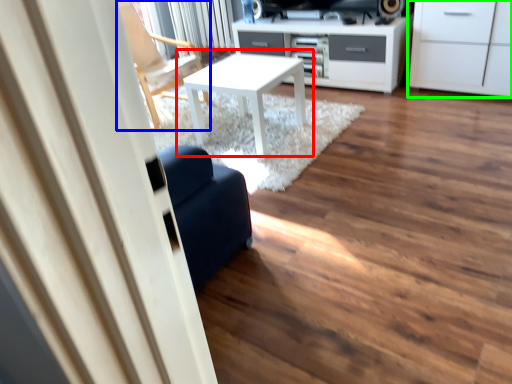
Question: Based on their relative distances, which object is farther from table (highlighted by a red box)? Choose from chair (highlighted by a blue box) and cabinetry (highlighted by a green box).

Choices:
 (A) chair
 (B) cabinetry

Answer: (B)